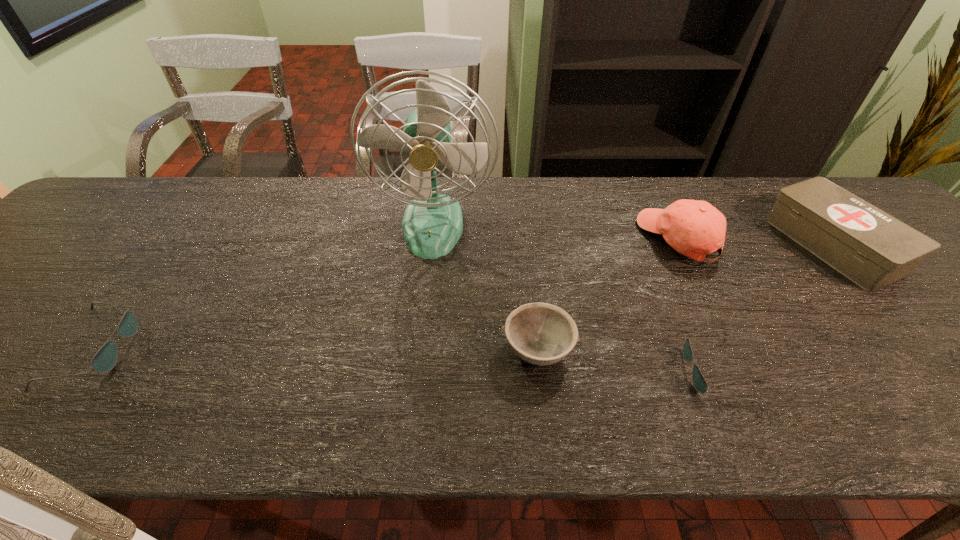
This screenshot has width=960, height=540. Find the location of `free spot located 0.080m on the lenses of the right sunglasses`. free spot located 0.080m on the lenses of the right sunglasses is located at coordinates (647, 372).

Identify the location of free space located 0.160m on the lenses of the right sunglasses. The image size is (960, 540). (607, 372).

Locate an element on the screen. free space located 0.380m on the lenses of the right sunglasses is located at coordinates (496, 372).

I want to click on vacant space positioned 0.290m in front of the tallest object, directing airflow, so click(419, 356).

The image size is (960, 540). Find the location of `free space located on the back of the third tallest object`. free space located on the back of the third tallest object is located at coordinates (788, 191).

Identify the location of free space located 0.290m on the right of the fifth shortest object. (828, 239).

Locate an element on the screen. The height and width of the screenshot is (540, 960). vacant region located on the right of the bowl is located at coordinates 618,350.

The height and width of the screenshot is (540, 960). Find the location of `fan that is at the far edge`. fan that is at the far edge is located at coordinates (432, 224).

I want to click on the first-aid kit that is at the far edge, so 873,249.

Image resolution: width=960 pixels, height=540 pixels. Find the location of `baseball cap that is at the far edge`. baseball cap that is at the far edge is located at coordinates (694, 228).